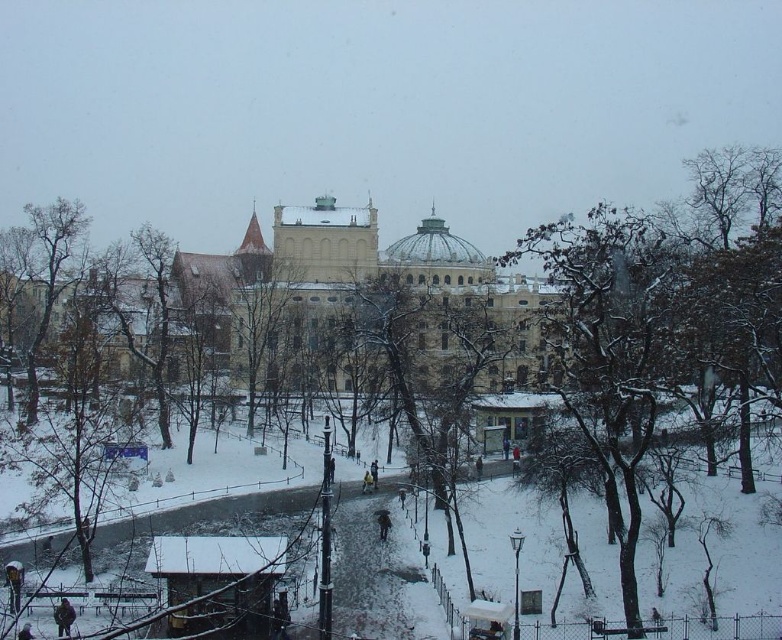
From the picture: Who is taller, snow-covered tree at center or brown textured tree at left?

With more height is snow-covered tree at center.

Find the location of a particular element. The height and width of the screenshot is (640, 782). snow-covered tree at center is located at coordinates (418, 369).

In order to click on snow-covered tree at center in this screenshot , I will do [418, 369].

Find the location of `snow-covered tree at center`. snow-covered tree at center is located at coordinates (418, 369).